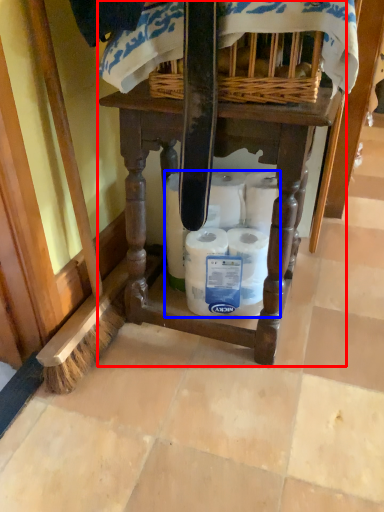
Question: Which point is closer to the camera, furniture (highlighted by a red box) or toilet paper (highlighted by a blue box)?

Choices:
 (A) furniture
 (B) toilet paper

Answer: (A)